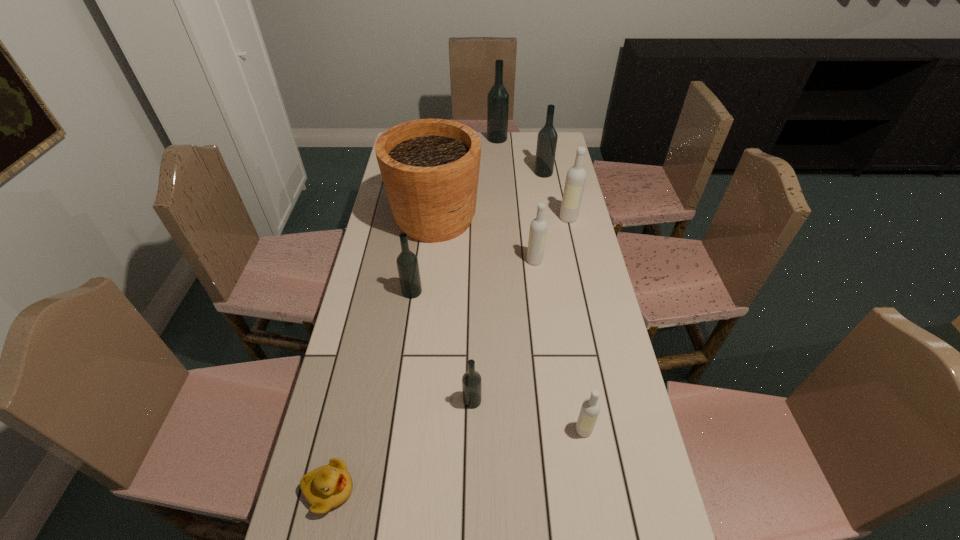
You are a GUI agent. You are given a task and a screenshot of the screen. Output one action in this format:
    pyautogui.click(x=<x>, y=<y>)
    Task: Click on the vacant space at the left edge of the desktop
    
    Given the screenshot: What is the action you would take?
    pyautogui.click(x=353, y=477)

Locate an element on the screen. The height and width of the screenshot is (540, 960). blank area at the right edge is located at coordinates (559, 331).

The height and width of the screenshot is (540, 960). I want to click on free area in between the leftmost white vodka and the flowerpot, so click(x=485, y=240).

Identify the location of free area in between the rightmost black vodka and the sixth farthest object. (478, 232).

In order to click on vacant space that is in between the second white vodka from right to left and the farthest white vodka in this screenshot , I will do click(576, 324).

The width and height of the screenshot is (960, 540). Find the location of `vacant area between the third farthest vodka and the yellow duckling`. vacant area between the third farthest vodka and the yellow duckling is located at coordinates [449, 354].

You are a GUI agent. You are given a task and a screenshot of the screen. Output one action in this format:
    pyautogui.click(x=<x>, y=<y>)
    Task: Click on the vacant space that is in between the second black vodka from left to right and the fifth vodka from right to left
    The width and height of the screenshot is (960, 540).
    Given the screenshot: What is the action you would take?
    pyautogui.click(x=485, y=269)

Identify the location of free space between the shortest object and the biggest white vodka. (449, 354).

At what (x,y) coordinates should I click in order to perform the action: click on unoccupied position between the flowerpot and the second nearest vodka. Please return your answer as a coordinate pair (x, y). Looking at the image, I should click on (454, 309).

The height and width of the screenshot is (540, 960). In order to click on empty space between the third nearest black vodka and the second white vodka from left to right in this screenshot , I will do `click(564, 301)`.